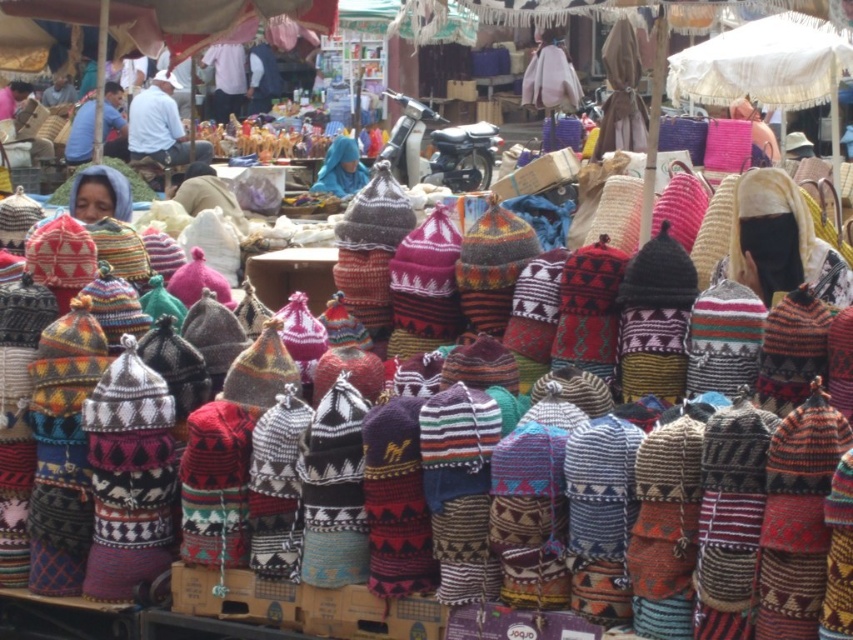
This screenshot has height=640, width=853. What are the coordinates of `light blue cotton shirt at center` in the screenshot? It's located at (161, 125).

Is light blue cotton shirt at center positioned before blue knitted hat at center?

No, light blue cotton shirt at center is behind blue knitted hat at center.

Describe the element at coordinates (161, 125) in the screenshot. I see `light blue cotton shirt at center` at that location.

At what (x,y) coordinates should I click in order to perform the action: click on light blue cotton shirt at center. Please return your answer as a coordinate pair (x, y). This screenshot has width=853, height=640. Looking at the image, I should click on (161, 125).

Is light blue cotton shirt at center taller than matte blue shirt at upper left?

In fact, light blue cotton shirt at center may be shorter than matte blue shirt at upper left.

What do you see at coordinates (161, 125) in the screenshot?
I see `light blue cotton shirt at center` at bounding box center [161, 125].

Measure the distance between light blue cotton shirt at center and camera.

They are 298.72 feet apart.

Where is `light blue cotton shirt at center`? light blue cotton shirt at center is located at coordinates (161, 125).

Does matte blue shirt at upper left have a lesser width compared to blue knitted hat at center?

No, matte blue shirt at upper left is not thinner than blue knitted hat at center.

Who is shorter, matte blue shirt at upper left or blue knitted hat at center?

blue knitted hat at center is shorter.

Image resolution: width=853 pixels, height=640 pixels. In order to click on matte blue shirt at upper left in this screenshot , I will do `click(113, 122)`.